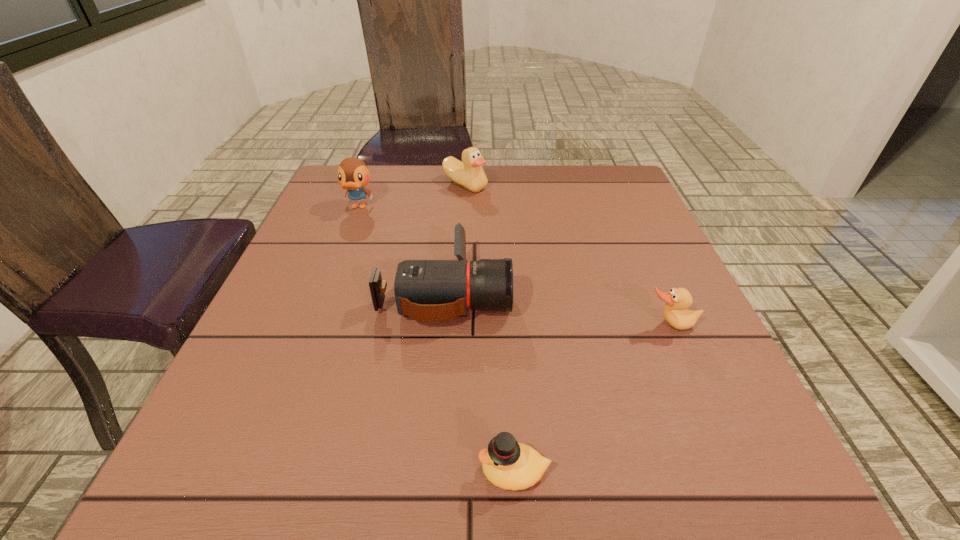
The image size is (960, 540). What are the coordinates of `vacant region at the right edge` in the screenshot? It's located at (605, 221).

The height and width of the screenshot is (540, 960). I want to click on vacant space at the near left corner of the desktop, so [207, 503].

Where is `vacant space at the far right corner of the desktop`? vacant space at the far right corner of the desktop is located at coordinates (592, 174).

Locate an element on the screen. unoccupied area between the camcorder and the leftmost duck is located at coordinates (401, 249).

Find the location of a particular element. The height and width of the screenshot is (540, 960). unoccupied position between the leftmost object and the farthest duck is located at coordinates (412, 196).

You are a GUI agent. You are given a task and a screenshot of the screen. Output one action in this format:
    pyautogui.click(x=<x>, y=<y>)
    Task: Click on the vacant area that lies between the second farthest object and the camcorder
    
    Given the screenshot: What is the action you would take?
    pyautogui.click(x=401, y=249)

Locate an element on the screen. free space between the camcorder and the fourth nearest object is located at coordinates (401, 249).

Find the location of a particular element. free space that is in between the nearest duck and the camcorder is located at coordinates (479, 381).

Find the location of `vacant region between the nearest object and the farthest object`. vacant region between the nearest object and the farthest object is located at coordinates (490, 328).

This screenshot has width=960, height=540. What are the coordinates of `free space between the rightmost duck and the camcorder` in the screenshot? It's located at (558, 308).